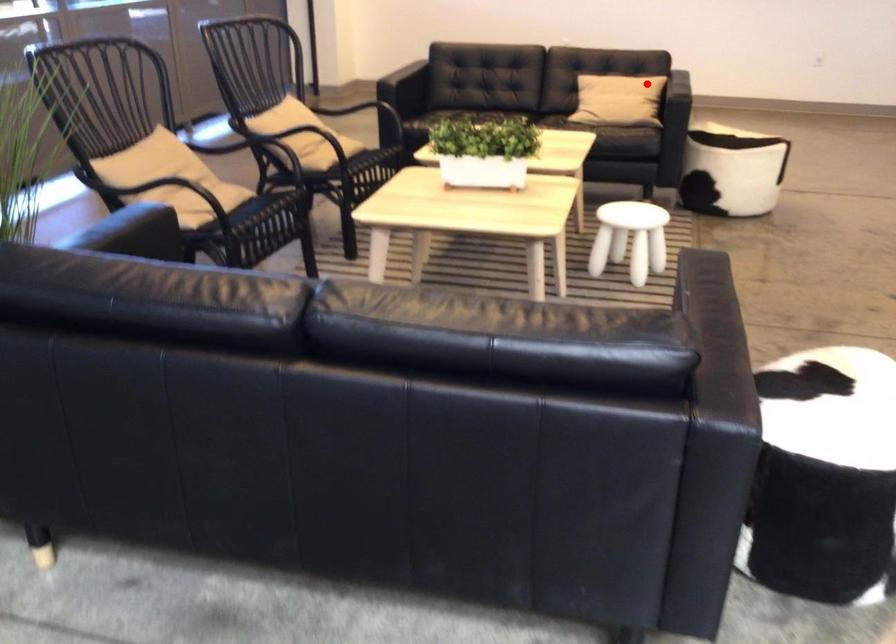
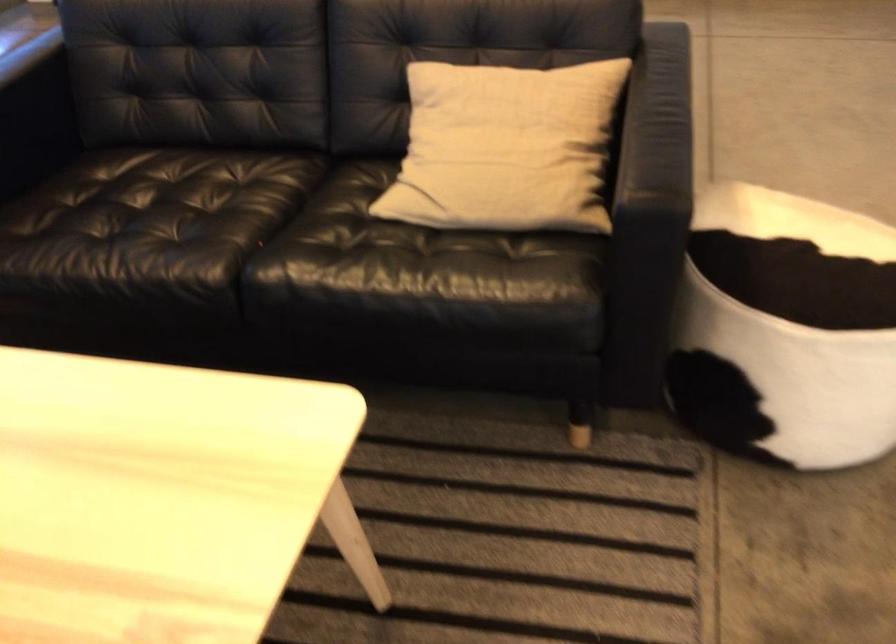
The point at the highlighted location is marked in the first image. Where is the corresponding point in the second image?

(505, 147)